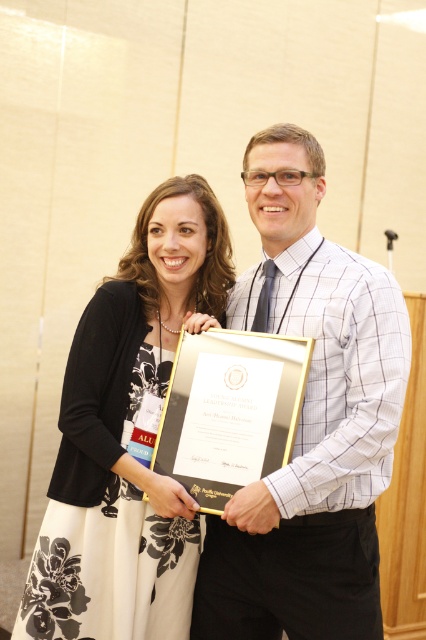
From the picture: You are a photographer at an award ceremony. You want to take a photo of the two people holding the framed certificate. The camera you are using has a minimum focus distance of 8 inches. Will you be able to focus on both the white checkered shirt at center and the gold metallic plaque at center without moving the camera?

The distance between the white checkered shirt at center and the gold metallic plaque at center is 7.63 inches, which is less than the camera minimum focus distance of 8 inches. Therefore, the camera can focus on both objects without moving.

You are a photographer at an award ceremony. You need to capture a clear photo of the gold metallic plaque at center while ensuring the black floral dress at center is visible in the background. Is the current positioning of the objects suitable for this shot?

The black floral dress at center is further to the viewer than gold metallic plaque at center, so the gold metallic plaque at center will be behind the black floral dress at center in the photo. This means the gold metallic plaque at center might be obstructed, making it difficult to capture clearly. Adjust their positions so the plaque is in front.

You are a photographer at an award ceremony. You need to capture a photo of the two people holding the certificate. The camera you are using has a focus point that can only target one object at a time. If you want to focus on the white checkered shirt at center and the black floral dress at center, which one should you choose to ensure both are in focus?

The white checkered shirt at center is located above the black floral dress at center. Since the camera can only focus on one object at a time, you should choose the black floral dress at center as the focus point because it is closer to the camera, ensuring both the white checkered shirt at center and the black floral dress at center are in focus.